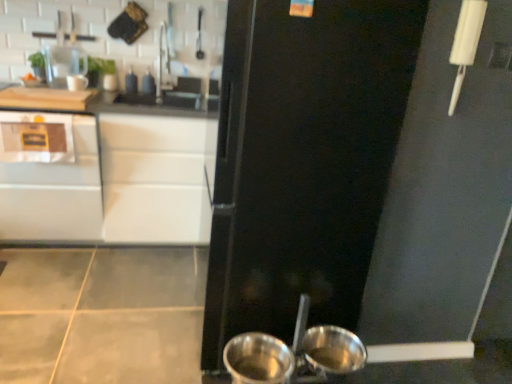
At what (x,y) coordinates should I click in order to perform the action: click on vacant space to the right of brushed metal faucet at upper center. Please return your answer as a coordinate pair (x, y). This screenshot has height=384, width=512. Looking at the image, I should click on (191, 97).